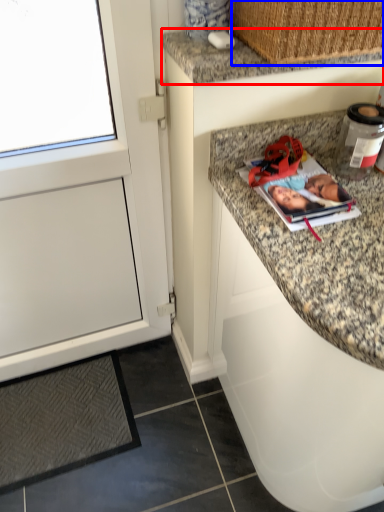
Question: Which of the following is the closest to the observer, countertop (highlighted by a red box) or basket (highlighted by a blue box)?

Choices:
 (A) countertop
 (B) basket

Answer: (B)